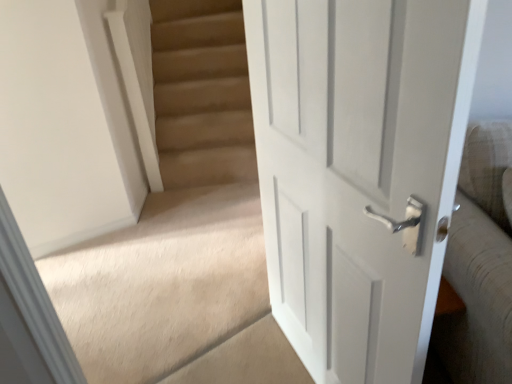
Question: In terms of height, does carpeted stairs at center look taller or shorter compared to white painted wood door at right?

Choices:
 (A) short
 (B) tall

Answer: (B)

Question: From a real-world perspective, is carpeted stairs at center positioned above or below white painted wood door at right?

Choices:
 (A) below
 (B) above

Answer: (B)

Question: Does point (225, 74) appear closer or farther from the camera than point (461, 23)?

Choices:
 (A) farther
 (B) closer

Answer: (A)

Question: Looking at their shapes, would you say white painted wood door at right is wider or thinner than carpeted stairs at center?

Choices:
 (A) wide
 (B) thin

Answer: (B)

Question: Is white painted wood door at right taller or shorter than carpeted stairs at center?

Choices:
 (A) tall
 (B) short

Answer: (B)

Question: Which is correct: white painted wood door at right is inside carpeted stairs at center, or outside of it?

Choices:
 (A) inside
 (B) outside

Answer: (B)

Question: Based on their sizes in the image, would you say white painted wood door at right is bigger or smaller than carpeted stairs at center?

Choices:
 (A) small
 (B) big

Answer: (A)